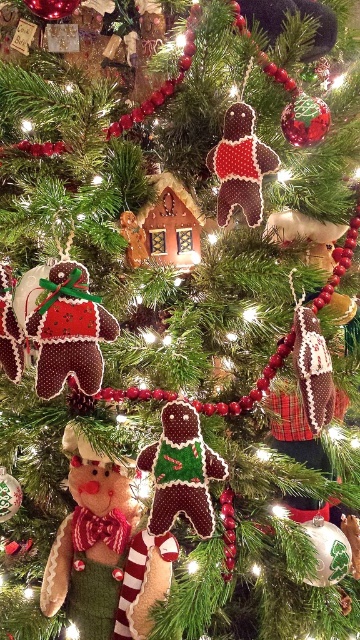
Between green knitted gingerbread man at center and green felt gingerbread man at center, which one has more height?

With more height is green knitted gingerbread man at center.

Does green knitted gingerbread man at center appear on the left side of green felt gingerbread man at center?

Correct, you'll find green knitted gingerbread man at center to the left of green felt gingerbread man at center.

You are a GUI agent. You are given a task and a screenshot of the screen. Output one action in this format:
    pyautogui.click(x=<x>, y=<y>)
    Task: Click on the green knitted gingerbread man at center
    The image size is (360, 640).
    Given the screenshot: What is the action you would take?
    pyautogui.click(x=104, y=552)

Locate an element on the screen. green knitted gingerbread man at center is located at coordinates (104, 552).

Can you confirm if green knitted gingerbread man at center is taller than matte brown gingerbread man at center?

Yes, green knitted gingerbread man at center is taller than matte brown gingerbread man at center.

Can you confirm if green knitted gingerbread man at center is bigger than matte brown gingerbread man at center?

Yes, green knitted gingerbread man at center is bigger than matte brown gingerbread man at center.

You are a GUI agent. You are given a task and a screenshot of the screen. Output one action in this format:
    pyautogui.click(x=<x>, y=<y>)
    Task: Click on the green knitted gingerbread man at center
    The height and width of the screenshot is (640, 360).
    Given the screenshot: What is the action you would take?
    pyautogui.click(x=104, y=552)

Find the location of a particular element. This screenshot has height=640, width=360. green felt gingerbread man at center is located at coordinates (181, 472).

You are a GUI agent. You are given a task and a screenshot of the screen. Output one action in this format:
    pyautogui.click(x=<x>, y=<y>)
    Task: Click on the green felt gingerbread man at center
    This screenshot has height=640, width=360.
    Given the screenshot: What is the action you would take?
    pyautogui.click(x=181, y=472)

Where is `green felt gingerbread man at center`? This screenshot has height=640, width=360. green felt gingerbread man at center is located at coordinates (181, 472).